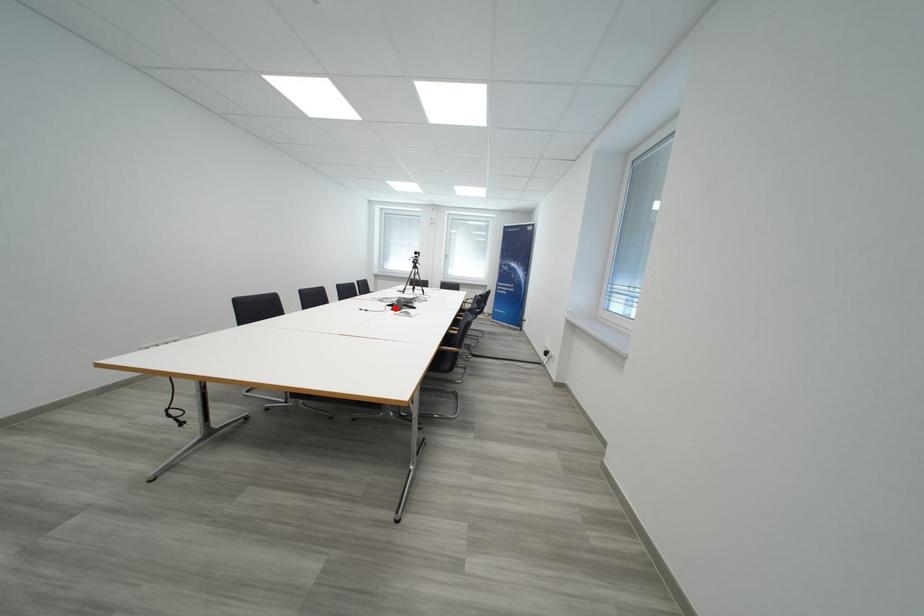
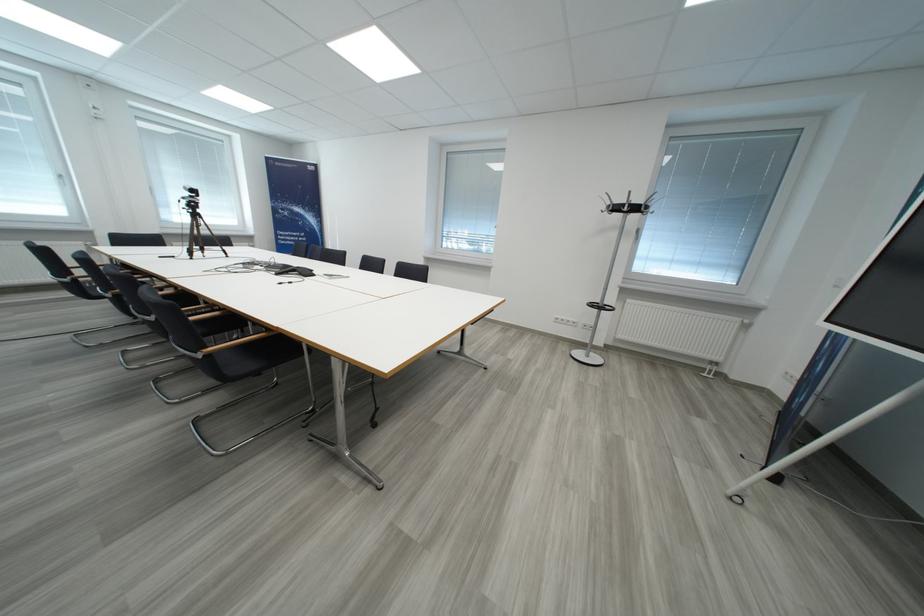
Question: I am providing you with two images of the same scene from different viewpoints. A red point is marked on the first image. Can you still see the location of the red point in image 2?

Choices:
 (A) Yes
 (B) No

Answer: (B)